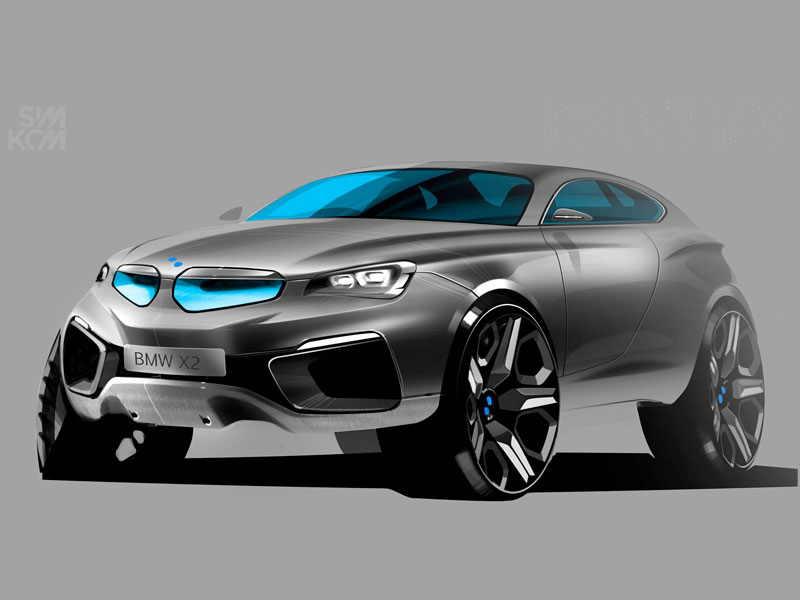
The width and height of the screenshot is (800, 600). Find the location of `hood`. hood is located at coordinates (280, 246).